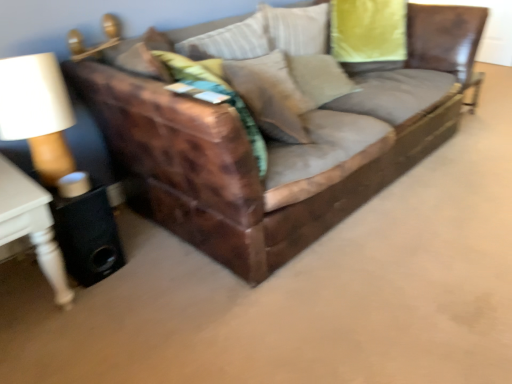
Question: Do you think suede-like beige pillow at center is within white wood side table at left, or outside of it?

Choices:
 (A) outside
 (B) inside

Answer: (A)

Question: Based on their positions, is suede-like beige pillow at center located to the left or right of white wood side table at left?

Choices:
 (A) right
 (B) left

Answer: (A)

Question: Estimate the real-world distances between objects in this image. Which object is farther from the white wood side table at left?

Choices:
 (A) suede-like beige pillow at center
 (B) leather couch at center

Answer: (A)

Question: Which of these objects is positioned closest to the suede-like beige pillow at center?

Choices:
 (A) leather couch at center
 (B) white wood side table at left

Answer: (A)